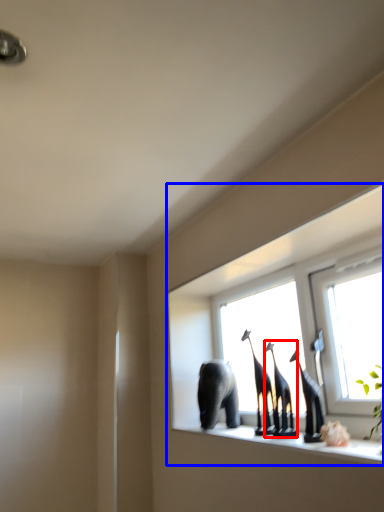
Question: Which of the following is the closest to the observer, animal (highlighted by a red box) or window (highlighted by a blue box)?

Choices:
 (A) animal
 (B) window

Answer: (B)